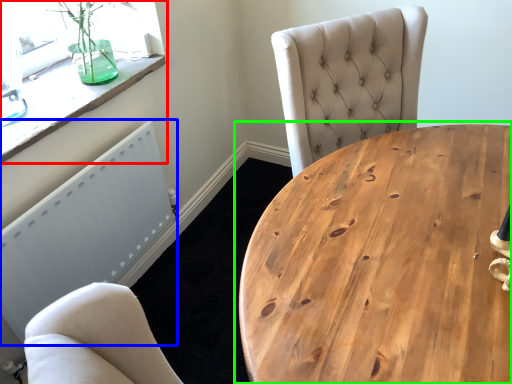
Question: Which is nearer to the window (highlighted by a red box)? radiator (highlighted by a blue box) or coffee table (highlighted by a green box).

Choices:
 (A) radiator
 (B) coffee table

Answer: (A)